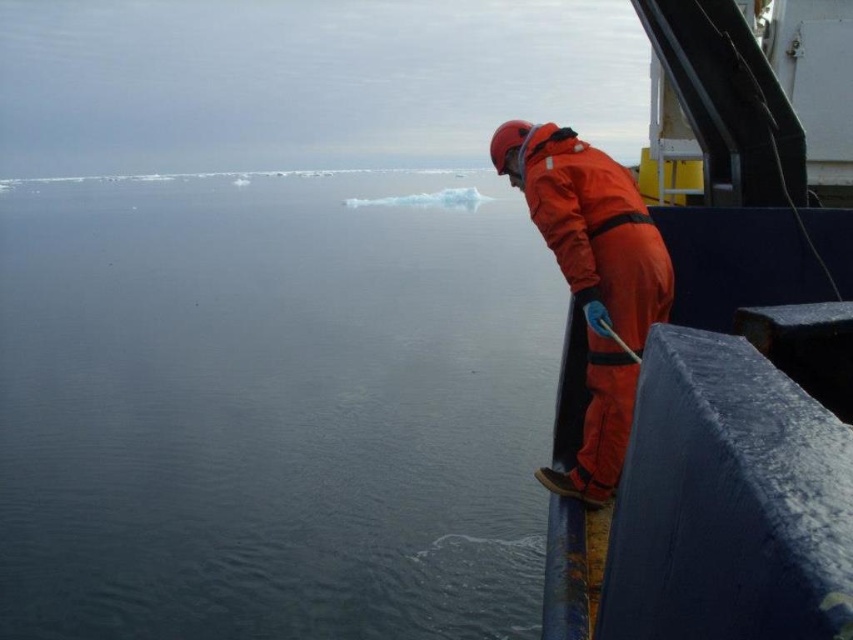
Which of these two, dark blue water at center or orange waterproof suit at right, stands taller?

Standing taller between the two is dark blue water at center.

Which is behind, point (202, 180) or point (612, 378)?

Positioned behind is point (202, 180).

Who is more distant from viewer, (286,388) or (614,236)?

The point (286,388) is behind.

Find the location of a particular element. This screenshot has height=640, width=853. dark blue water at center is located at coordinates (271, 406).

Can you confirm if dark blue water at center is wider than orange fabric boat at right?

Indeed, dark blue water at center has a greater width compared to orange fabric boat at right.

Who is positioned more to the right, dark blue water at center or orange fabric boat at right?

orange fabric boat at right

Find the location of `dark blue water at center`. dark blue water at center is located at coordinates (271, 406).

You are a GUI agent. You are given a task and a screenshot of the screen. Output one action in this format:
    pyautogui.click(x=<x>, y=<y>)
    Task: Click on the dark blue water at center
    This screenshot has height=640, width=853.
    Given the screenshot: What is the action you would take?
    pyautogui.click(x=271, y=406)

Between orange fabric boat at right and orange waterproof suit at right, which one appears on the right side from the viewer's perspective?

Positioned to the right is orange fabric boat at right.

Between point (764, 358) and point (604, 408), which one is positioned in front?

Point (764, 358) is in front.

Does point (582, 410) come in front of point (585, 186)?

No, it is not.

Where is `orange fabric boat at right`? orange fabric boat at right is located at coordinates (727, 385).